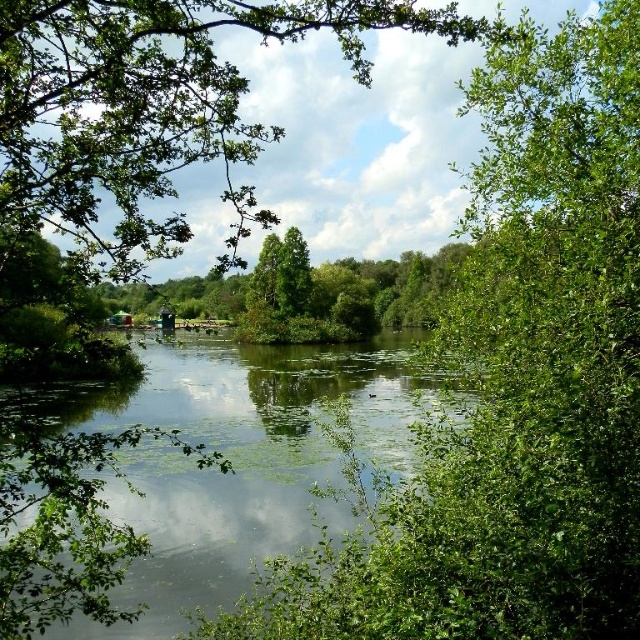
Question: Which point is closer to the camera?

Choices:
 (A) green leafy tree at upper center
 (B) green leafy river at center
 (C) green leafy tree at center

Answer: (A)

Question: Among these points, which one is farthest from the camera?

Choices:
 (A) (120, 419)
 (B) (104, 88)

Answer: (A)

Question: Can you confirm if green leafy tree at upper center is positioned above green leafy river at center?

Choices:
 (A) no
 (B) yes

Answer: (B)

Question: In this image, where is green leafy river at center located relative to green leafy tree at center?

Choices:
 (A) left
 (B) right

Answer: (A)

Question: Among these points, which one is nearest to the camera?

Choices:
 (A) (193, 60)
 (B) (120, 493)
 (C) (404, 312)

Answer: (A)

Question: Does green leafy river at center appear on the right side of green leafy tree at center?

Choices:
 (A) no
 (B) yes

Answer: (A)